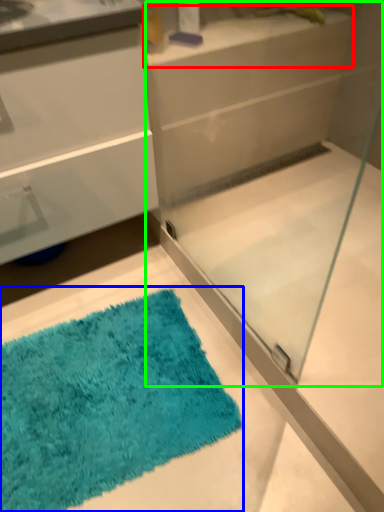
Question: Which object is the farthest from counter top (highlighted by a red box)? Choose among these: bath mat (highlighted by a blue box) or glass box (highlighted by a green box).

Choices:
 (A) bath mat
 (B) glass box

Answer: (A)